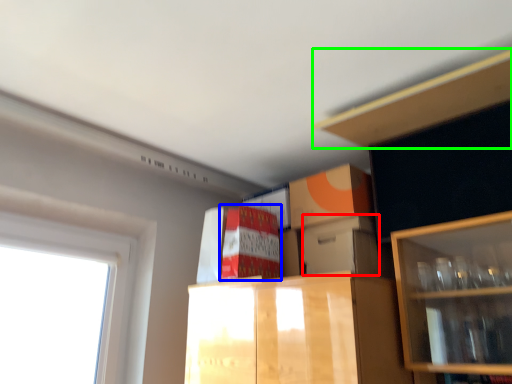
Question: Which object is positioned closest to storage box (highlighted by a red box)? Select from cabinetry (highlighted by a blue box) and cabinet (highlighted by a green box).

Choices:
 (A) cabinetry
 (B) cabinet

Answer: (A)